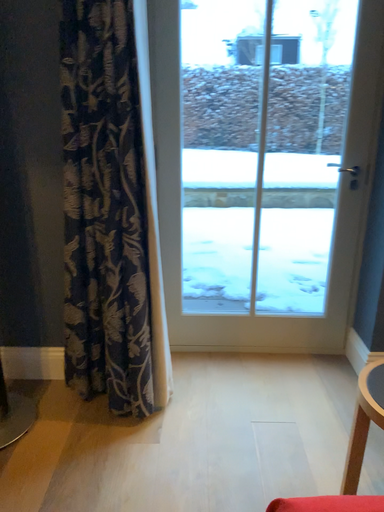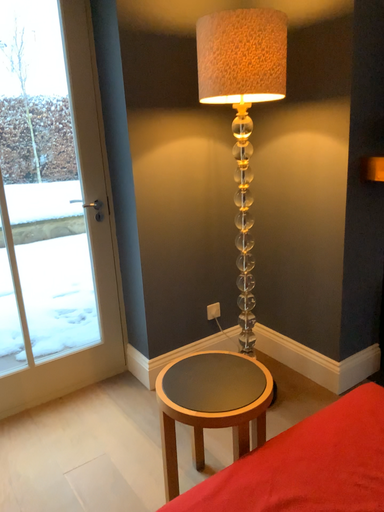
Question: How did the camera likely rotate when shooting the video?

Choices:
 (A) rotated downward
 (B) rotated upward

Answer: (B)